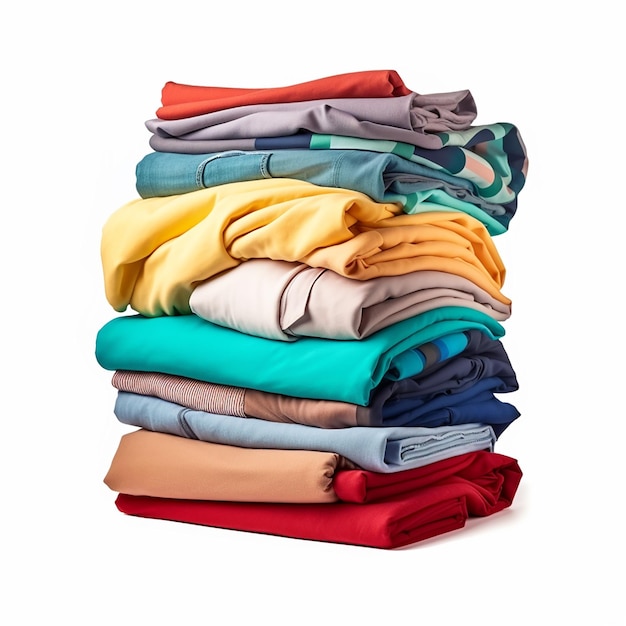
Identify the location of folded garment. This screenshot has height=626, width=626. (359, 80), (392, 104), (357, 172), (265, 212), (264, 285), (245, 342), (249, 402), (228, 426), (217, 456), (350, 524).